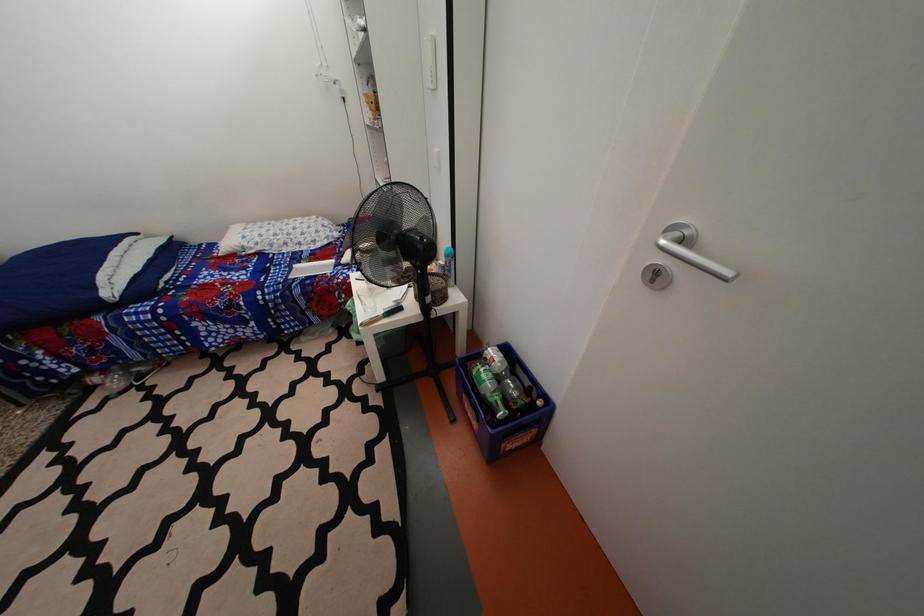
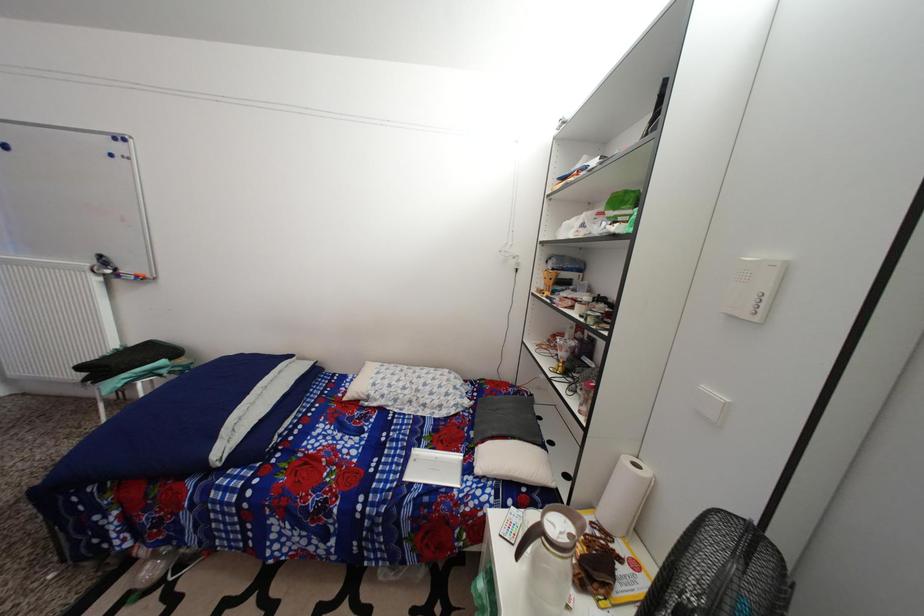
In the scene shown: The images are taken continuously from a first-person perspective. In which direction is your viewpoint rotating?

The rotation direction of the camera is left-up.